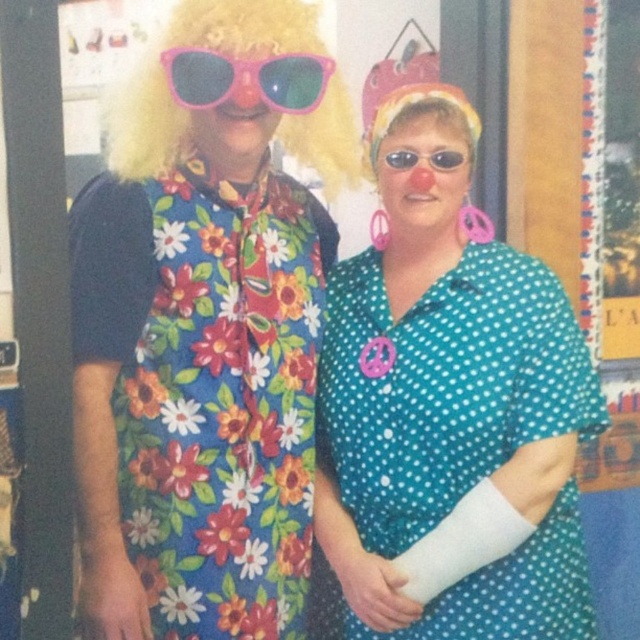
You are a photographer setting up for a photoshoot and need to position a light source between the floral fabric dress at left and the fluffy blonde wig at upper left. Based on their positions, where should you place the light source?

The light source should be placed between the floral fabric dress at left and the fluffy blonde wig at upper left. Since the floral fabric dress at left is located below the fluffy blonde wig at upper left, the light source should be positioned above the dress and below the wig to ensure it is between them.

You are planning to take a photo of the teal polka dot dress at center and the fluffy blonde wig at upper left. Since you want both subjects to appear equally prominent in the photo, which one should you zoom in more on?

The teal polka dot dress at center has a lesser width compared to the fluffy blonde wig at upper left, so you should zoom in more on the teal polka dot dress at center to make it appear larger and balance its prominence with the wig.

You are a photographer setting up a shoot in this scene. You need to position a light source to the right of both the fluffy blonde wig at upper left and the pink plastic sunglasses at upper center. Is this possible given their positions?

The fluffy blonde wig at upper left is to the left of pink plastic sunglasses at upper center, so placing a light source to the right of both is possible as long as it is positioned to the right of the pink plastic sunglasses at upper center.